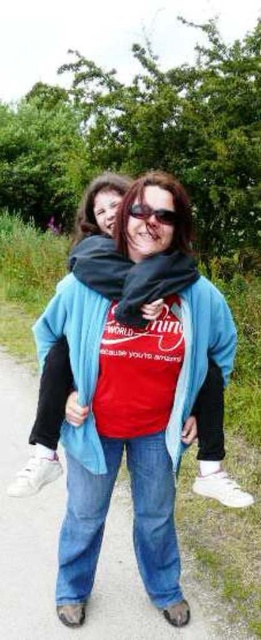
Question: Which point is closer to the camera?

Choices:
 (A) (145, 220)
 (B) (50, 509)

Answer: (A)

Question: Where is denim jeans at lower center located in relation to matte blue sweatshirt at center in the image?

Choices:
 (A) left
 (B) right

Answer: (A)

Question: Can you confirm if denim jeans at lower center is thinner than shiny black sunglasses at center?

Choices:
 (A) yes
 (B) no

Answer: (B)

Question: Is matte blue sweatshirt at center to the right of shiny black sunglasses at center from the viewer's perspective?

Choices:
 (A) yes
 (B) no

Answer: (B)

Question: Which of the following is the closest to the observer?

Choices:
 (A) (165, 211)
 (B) (252, 625)
 (C) (232, 337)

Answer: (A)

Question: Which object appears farthest from the camera in this image?

Choices:
 (A) denim jeans at lower center
 (B) matte blue sweatshirt at center
 (C) shiny black sunglasses at center

Answer: (A)